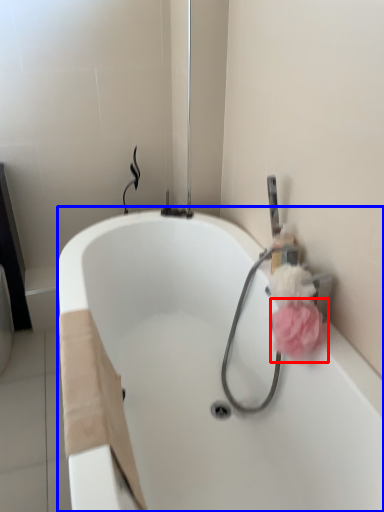
Question: Which of the following is the closest to the observer, flower (highlighted by a red box) or bathtub (highlighted by a blue box)?

Choices:
 (A) flower
 (B) bathtub

Answer: (B)